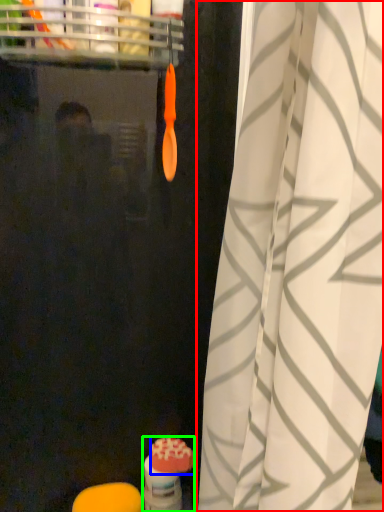
Question: Estimate the real-world distances between objects in this image. Which object is closer to curtain (highlighted by a red box), soap (highlighted by a blue box) or toiletry (highlighted by a green box)?

Choices:
 (A) soap
 (B) toiletry

Answer: (B)